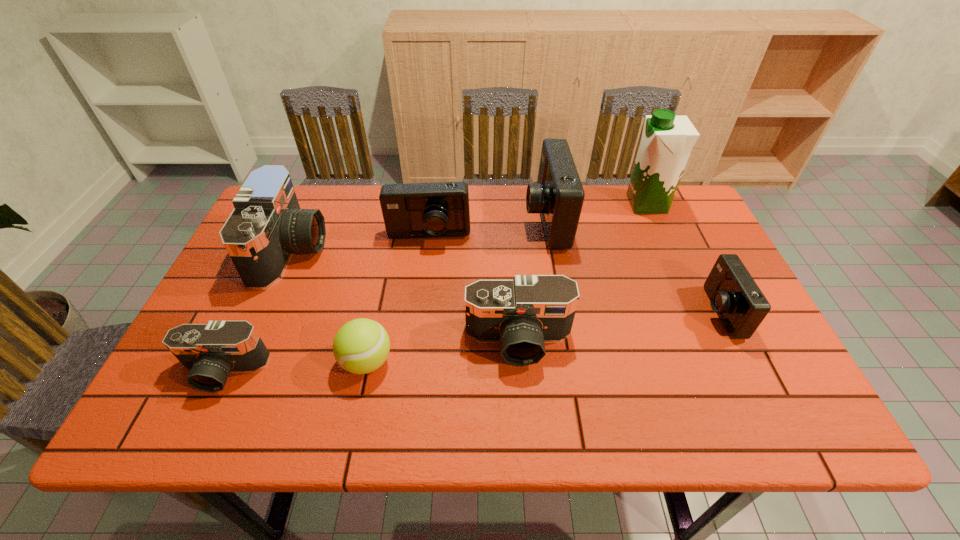
Choose which black camera is the second nearest neighbor to the farthest black camera. Please provide its 2D coordinates. Your answer should be formatted as a tuple, i.e. [(x, y)], where the tuple contains the x and y coordinates of a point satisfying the conditions above.

[(522, 314)]

At what (x,y) coordinates should I click in order to perform the action: click on free point that satisfies the following two spatial constraints: 1. on the front-facing side of the biggest black camera; 2. on the front-facing side of the smallest black camera. Please return your answer as a coordinate pair (x, y). Image resolution: width=960 pixels, height=540 pixels. Looking at the image, I should click on (239, 371).

I want to click on free region that satisfies the following two spatial constraints: 1. on the front-facing side of the tallest object; 2. on the front-facing side of the leftmost blue camera, so click(661, 237).

At what (x,y) coordinates should I click in order to perform the action: click on free location that satisfies the following two spatial constraints: 1. on the front-facing side of the soya milk; 2. on the front-facing side of the smallest black camera. Please return your answer as a coordinate pair (x, y). Looking at the image, I should click on (x=720, y=371).